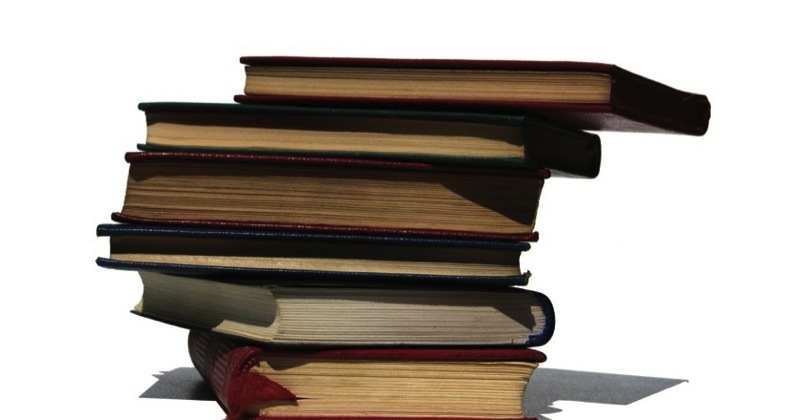
Locate an element on the screen. This screenshot has height=420, width=790. stacked hardcover books is located at coordinates (483, 88), (429, 139), (405, 194), (359, 254), (377, 320), (382, 384).